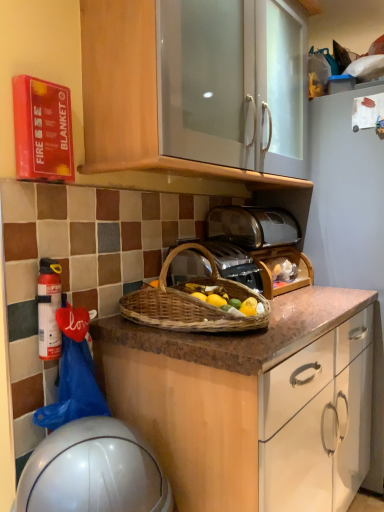
Question: Looking at their shapes, would you say matte wood cabinet at upper center is wider or thinner than satin silver toaster at center?

Choices:
 (A) wide
 (B) thin

Answer: (A)

Question: Would you say matte wood cabinet at upper center is to the left or to the right of satin silver toaster at center in the picture?

Choices:
 (A) right
 (B) left

Answer: (B)

Question: Estimate the real-world distances between objects in this image. Which object is farther from the metallic silver toaster at center?

Choices:
 (A) woven brown picnic basket at center
 (B) white glossy helmet at lower left
 (C) satin silver toaster at center
 (D) matte wood cabinet at upper center
 (E) white matte fire extinguisher at left

Answer: (B)

Question: Which is nearer to the white glossy helmet at lower left?

Choices:
 (A) metallic silver toaster at center
 (B) satin silver toaster at center
 (C) white matte fire extinguisher at left
 (D) matte wood cabinet at upper center
 (E) woven brown picnic basket at center

Answer: (C)